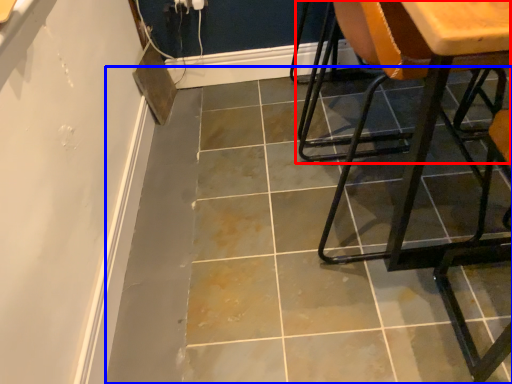
Question: Which point is closer to the camera, chair (highlighted by a red box) or concrete (highlighted by a blue box)?

Choices:
 (A) chair
 (B) concrete

Answer: (B)